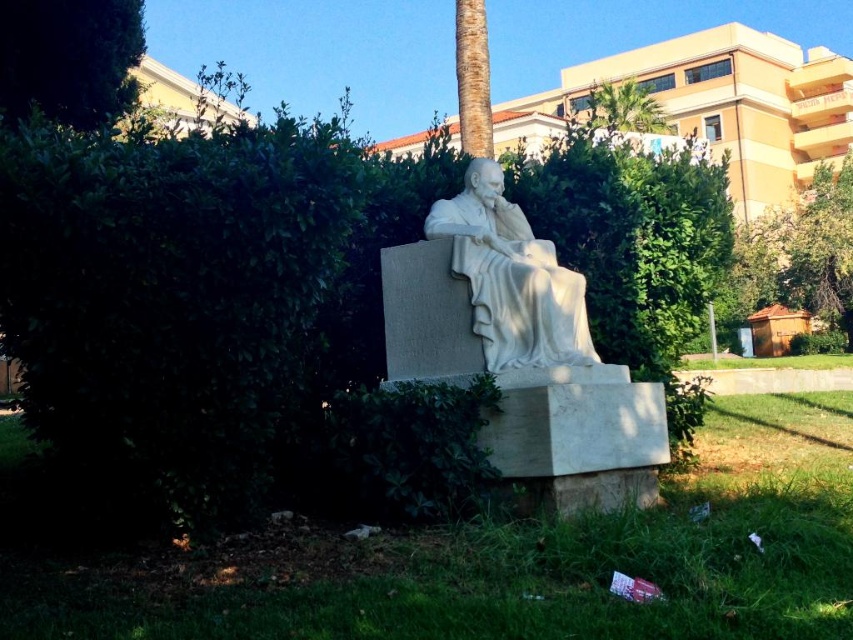
Question: Which object is the closest to the white marble statue at center?

Choices:
 (A) brown textured palm tree at upper center
 (B) green leafy tree at upper right

Answer: (A)

Question: Does green leafy tree at upper left appear on the left side of green leafy tree at upper right?

Choices:
 (A) no
 (B) yes

Answer: (B)

Question: Which point is closer to the camera?

Choices:
 (A) (840, 304)
 (B) (461, 109)

Answer: (B)

Question: Is brown textured palm tree at upper center positioned at the back of green leafy palm tree at upper center?

Choices:
 (A) no
 (B) yes

Answer: (B)

Question: Does brown textured palm tree at upper center appear under green leafy palm tree at upper center?

Choices:
 (A) no
 (B) yes

Answer: (A)

Question: Which object appears closest to the camera in this image?

Choices:
 (A) brown textured palm tree at upper center
 (B) green leafy tree at upper right
 (C) green leafy palm tree at upper center

Answer: (C)